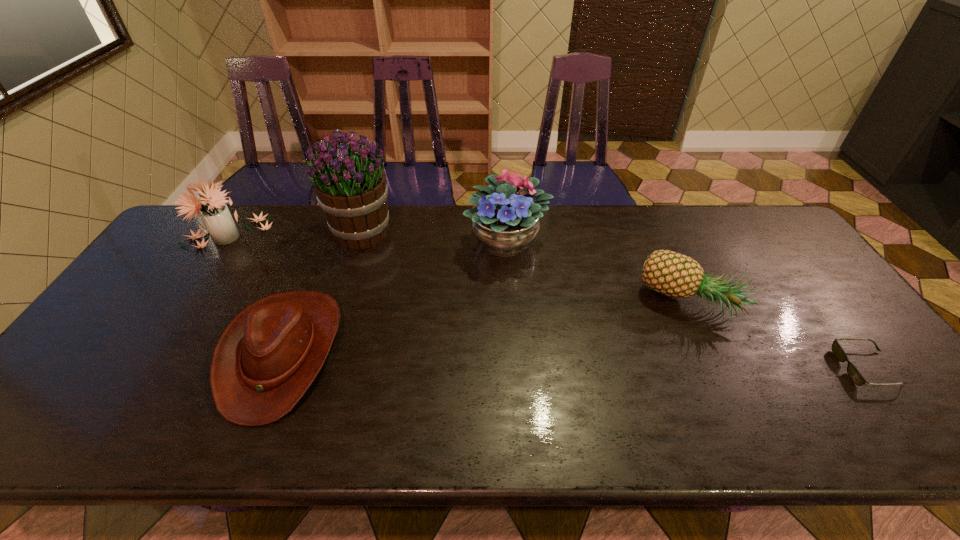
Where is `free spot between the leftmost bouquet and the cowboy hat`? free spot between the leftmost bouquet and the cowboy hat is located at coordinates (254, 294).

Identify the location of free spot between the sunglasses and the fourth tallest object. (778, 335).

Find the location of a particular element. This screenshot has height=540, width=960. free space between the pineapple and the fifth tallest object is located at coordinates (486, 328).

Locate an element on the screen. The height and width of the screenshot is (540, 960). free space between the second object from right to left and the leftmost bouquet is located at coordinates click(x=459, y=269).

Find the location of a particular element. vacant point located between the rightmost bouquet and the sunglasses is located at coordinates (686, 305).

Select which object appears as the closest to the sunglasses. Please provide its 2D coordinates. Your answer should be formatted as a tuple, i.e. [(x, y)], where the tuple contains the x and y coordinates of a point satisfying the conditions above.

[(673, 274)]

This screenshot has width=960, height=540. In order to click on object that stands as the third closest to the rightmost bouquet in this screenshot , I will do `click(265, 360)`.

Select which bouquet appears as the second closest to the cowboy hat. Please provide its 2D coordinates. Your answer should be formatted as a tuple, i.e. [(x, y)], where the tuple contains the x and y coordinates of a point satisfying the conditions above.

[(348, 178)]

This screenshot has height=540, width=960. What are the coordinates of `bouquet that is the closest to the leftmost bouquet` in the screenshot? It's located at (348, 178).